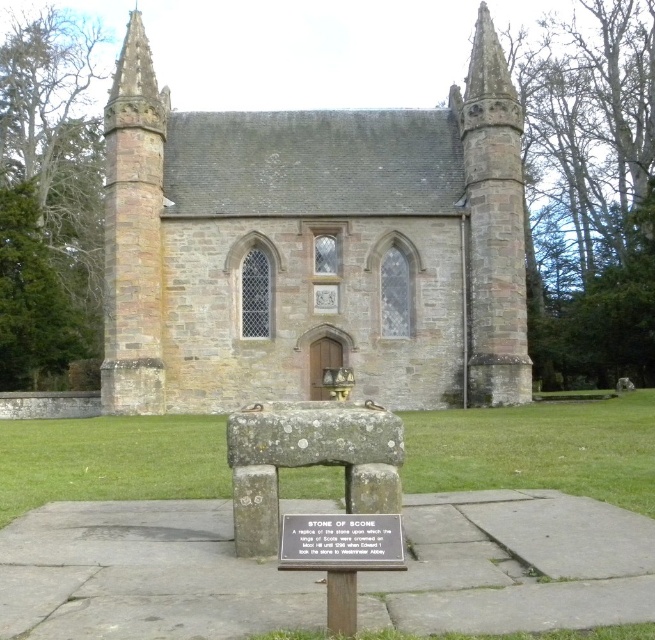
Question: Can you confirm if brown stone church at center is smaller than silver metallic plaque at center?

Choices:
 (A) yes
 (B) no

Answer: (B)

Question: Which point appears farthest from the camera in this image?

Choices:
 (A) (284, 522)
 (B) (487, 172)

Answer: (B)

Question: Does brown stone church at center have a lesser width compared to silver metallic plaque at center?

Choices:
 (A) yes
 (B) no

Answer: (B)

Question: Which point appears closest to the camera in this image?

Choices:
 (A) (377, 524)
 (B) (219, 173)

Answer: (A)

Question: Does brown stone church at center appear on the left side of silver metallic plaque at center?

Choices:
 (A) no
 (B) yes

Answer: (B)

Question: Which object is closer to the camera taking this photo?

Choices:
 (A) silver metallic plaque at center
 (B) brown stone church at center

Answer: (A)